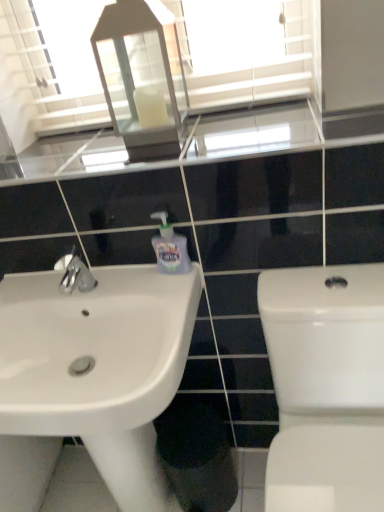
Find the location of a particular element. The height and width of the screenshot is (512, 384). free space on the front side of translucent plastic soap dispenser at center is located at coordinates (168, 293).